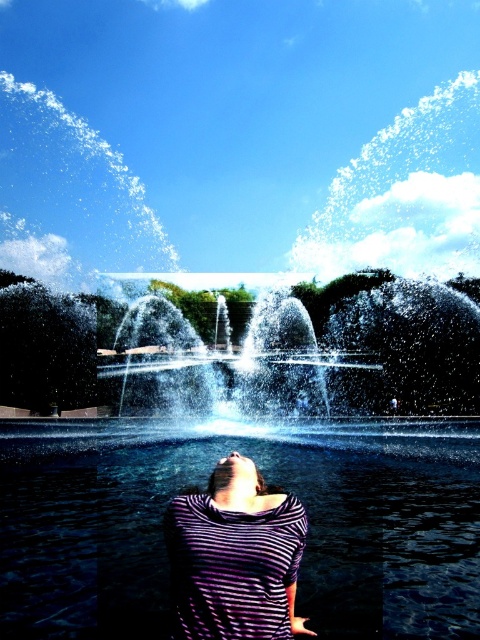
You are standing in the park and see the clear water at center and the purple striped shirt at center. Which object is positioned to the left?

The clear water at center is to the left of the purple striped shirt at center.

You are a photographer trying to capture the entire scene of the clear water at center and the purple striped shirt at center in one shot. Based on their sizes, will you need to adjust your camera to a wider angle to include both objects?

The clear water at center is larger in size than the purple striped shirt at center, so you will need to adjust your camera to a wider angle to include both objects in the shot.